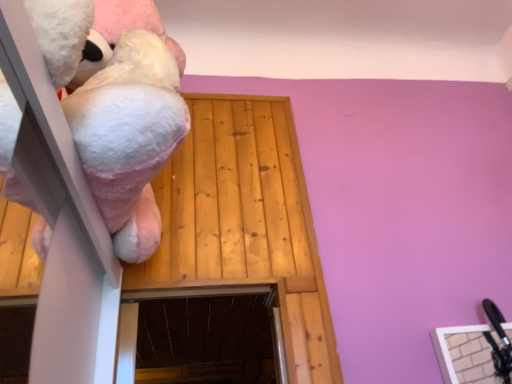
This screenshot has height=384, width=512. What are the coordinates of `fluffy white plush at left` in the screenshot? It's located at (138, 229).

Measure the distance between fluffy white plush at left and camera.

The depth of fluffy white plush at left is 23.35 inches.

The height and width of the screenshot is (384, 512). What do you see at coordinates (138, 229) in the screenshot?
I see `fluffy white plush at left` at bounding box center [138, 229].

Where is `fluffy white plush at left`? The width and height of the screenshot is (512, 384). fluffy white plush at left is located at coordinates (138, 229).